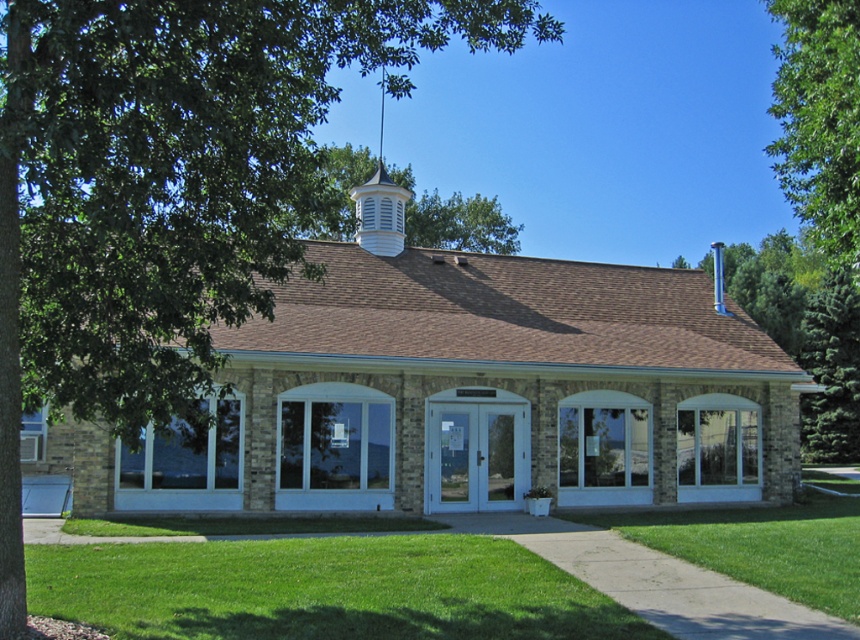
Question: Which object is closer to the camera taking this photo?

Choices:
 (A) brick building at center
 (B) green grass at lower center
 (C) white wood cupola at upper center

Answer: (B)

Question: Which of the following is the farthest from the observer?

Choices:
 (A) green leafy tree at upper left
 (B) green grass at lower center
 (C) brick building at center
 (D) green leafy tree at upper right

Answer: (C)

Question: Observing the image, what is the correct spatial positioning of green leafy tree at upper left in reference to green grass at lower center?

Choices:
 (A) above
 (B) below

Answer: (A)

Question: Which is nearer to the brick building at center?

Choices:
 (A) green leafy tree at upper left
 (B) white wood cupola at upper center

Answer: (A)

Question: Is green leafy tree at upper left further to camera compared to green leafy tree at upper right?

Choices:
 (A) no
 (B) yes

Answer: (A)

Question: Where is brick building at center located in relation to green leafy tree at upper right in the image?

Choices:
 (A) left
 (B) right

Answer: (A)